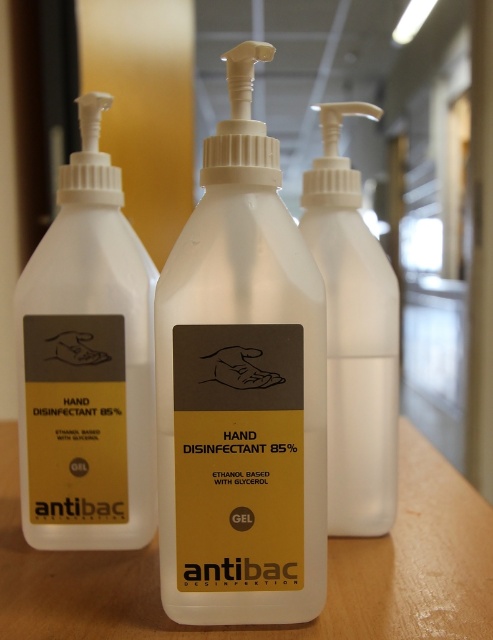
Question: Among these objects, which one is nearest to the camera?

Choices:
 (A) matte white hand sanitizer at left
 (B) white plastic hand sanitizer at center
 (C) white matte hand sanitizer at center

Answer: (C)

Question: Considering the relative positions of wooden table at center and white plastic hand sanitizer at center in the image provided, where is wooden table at center located with respect to white plastic hand sanitizer at center?

Choices:
 (A) above
 (B) below

Answer: (B)

Question: Can you confirm if white matte hand sanitizer at center is positioned to the left of white plastic hand sanitizer at center?

Choices:
 (A) no
 (B) yes

Answer: (B)

Question: Does white matte hand sanitizer at center have a larger size compared to matte white hand sanitizer at left?

Choices:
 (A) no
 (B) yes

Answer: (B)

Question: Among these objects, which one is farthest from the camera?

Choices:
 (A) white plastic hand sanitizer at center
 (B) white matte hand sanitizer at center
 (C) matte white hand sanitizer at left
 (D) wooden table at center

Answer: (C)

Question: Which object appears closest to the camera in this image?

Choices:
 (A) white matte hand sanitizer at center
 (B) matte white hand sanitizer at left
 (C) wooden table at center
 (D) white plastic hand sanitizer at center

Answer: (A)